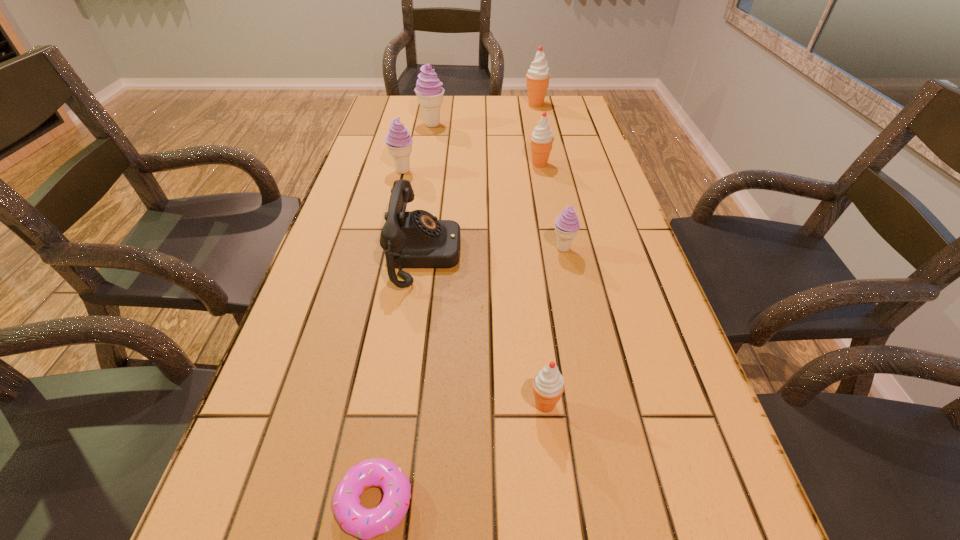
Image resolution: width=960 pixels, height=540 pixels. I want to click on the farthest red icecream, so click(538, 76).

Image resolution: width=960 pixels, height=540 pixels. In order to click on the biggest red icecream in this screenshot , I will do `click(538, 76)`.

Image resolution: width=960 pixels, height=540 pixels. I want to click on the fifth nearest icecream, so click(428, 89).

Image resolution: width=960 pixels, height=540 pixels. In order to click on the biggest purple icecream in this screenshot , I will do `click(428, 89)`.

Identify the location of the second smallest purple icecream. 399,142.

Where is `the second smallest red icecream`? the second smallest red icecream is located at coordinates coord(542,138).

The height and width of the screenshot is (540, 960). Find the location of `gray telephone`. gray telephone is located at coordinates (414, 239).

This screenshot has height=540, width=960. Identify the location of the nearest purple icecream. tap(566, 224).

This screenshot has height=540, width=960. What are the coordinates of `the fifth farthest icecream` in the screenshot? It's located at (566, 224).

The width and height of the screenshot is (960, 540). Identify the location of the second nearest object. (548, 384).